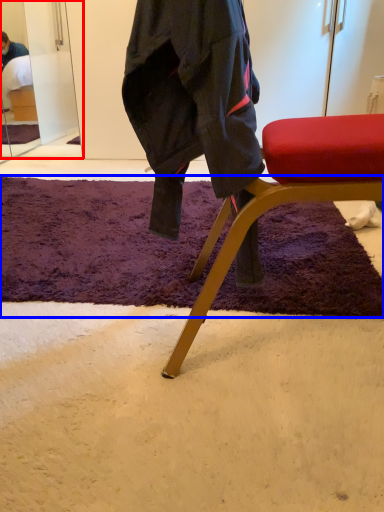
Question: Which point is further to the camera, mirror (highlighted by a red box) or mat (highlighted by a blue box)?

Choices:
 (A) mirror
 (B) mat

Answer: (A)